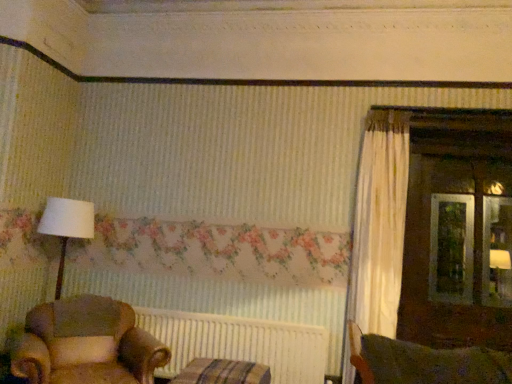
Identify the location of white ribbed radiator at center. The height and width of the screenshot is (384, 512). (239, 343).

How far apart are leather armchair at lower left and white ribbed radiator at center?

The distance of leather armchair at lower left from white ribbed radiator at center is 24.82 inches.

Is leather armchair at lower left aimed at white ribbed radiator at center?

No.

Identify the location of radiator behind the leather armchair at lower left. The image size is (512, 384). (239, 343).

Between leather armchair at lower left and white ribbed radiator at center, which one has smaller width?

white ribbed radiator at center is thinner.

From a real-world perspective, is white ribbed radiator at center on top of striped fabric cushion at lower center?

Correct, in the physical world, white ribbed radiator at center is higher than striped fabric cushion at lower center.

Is white ribbed radiator at center facing towards striped fabric cushion at lower center?

Yes.

Is point (278, 334) farther from viewer compared to point (198, 375)?

That is True.

Does white ribbed radiator at center come in front of leather armchair at lower left?

No, it is behind leather armchair at lower left.

Are white ribbed radiator at center and leather armchair at lower left far apart?

They are positioned close to each other.

Which object is positioned more to the left, white ribbed radiator at center or leather armchair at lower left?

leather armchair at lower left.

Is striped fabric cushion at lower center bigger or smaller than white ribbed radiator at center?

striped fabric cushion at lower center is bigger than white ribbed radiator at center.

Which is more to the left, striped fabric cushion at lower center or white ribbed radiator at center?

Positioned to the left is white ribbed radiator at center.

Is striped fabric cushion at lower center aimed at white ribbed radiator at center?

No, striped fabric cushion at lower center is not facing towards white ribbed radiator at center.

Is striped fabric cushion at lower center not near white ribbed radiator at center?

No, there isn't a large distance between striped fabric cushion at lower center and white ribbed radiator at center.

From the image's perspective, between striped fabric cushion at lower center and leather armchair at lower left, which one is located above?

leather armchair at lower left, from the image's perspective.

Does striped fabric cushion at lower center appear on the left side of leather armchair at lower left?

No.

Does striped fabric cushion at lower center turn towards leather armchair at lower left?

No, striped fabric cushion at lower center is not facing towards leather armchair at lower left.

How different are the orientations of leather armchair at lower left and striped fabric cushion at lower center in degrees?

The angular difference between leather armchair at lower left and striped fabric cushion at lower center is 36.5 degrees.

Is leather armchair at lower left thinner than striped fabric cushion at lower center?

In fact, leather armchair at lower left might be wider than striped fabric cushion at lower center.

Considering the sizes of objects leather armchair at lower left and striped fabric cushion at lower center in the image provided, who is taller, leather armchair at lower left or striped fabric cushion at lower center?

Standing taller between the two is leather armchair at lower left.

From the image's perspective, is leather armchair at lower left located above striped fabric cushion at lower center?

Yes.

Locate an element on the screen. Image resolution: width=512 pixels, height=384 pixels. chair that appears below the white ribbed radiator at center (from a real-world perspective) is located at coordinates (86, 344).

Find the location of `radiator lying above the striped fabric cushion at lower center (from the image's perspective)`. radiator lying above the striped fabric cushion at lower center (from the image's perspective) is located at coordinates (239, 343).

Estimate the real-world distances between objects in this image. Which object is further from white ribbed radiator at center, striped fabric cushion at lower center or leather armchair at lower left?

The object further to white ribbed radiator at center is leather armchair at lower left.

Which object lies further to the anchor point leather armchair at lower left, striped fabric cushion at lower center or white ribbed radiator at center?

white ribbed radiator at center lies further to leather armchair at lower left than the other object.

Looking at the image, which one is located closer to white ribbed radiator at center, leather armchair at lower left or striped fabric cushion at lower center?

The object closer to white ribbed radiator at center is striped fabric cushion at lower center.

Considering their positions, is white ribbed radiator at center positioned further to striped fabric cushion at lower center than leather armchair at lower left?

The object further to striped fabric cushion at lower center is leather armchair at lower left.

From the picture: Based on their spatial positions, is white ribbed radiator at center or striped fabric cushion at lower center further from leather armchair at lower left?

white ribbed radiator at center lies further to leather armchair at lower left than the other object.

Looking at the image, which one is located further to striped fabric cushion at lower center, leather armchair at lower left or white ribbed radiator at center?

leather armchair at lower left is further to striped fabric cushion at lower center.

Where is `radiator between leather armchair at lower left and striped fabric cushion at lower center`? This screenshot has height=384, width=512. radiator between leather armchair at lower left and striped fabric cushion at lower center is located at coordinates (239, 343).